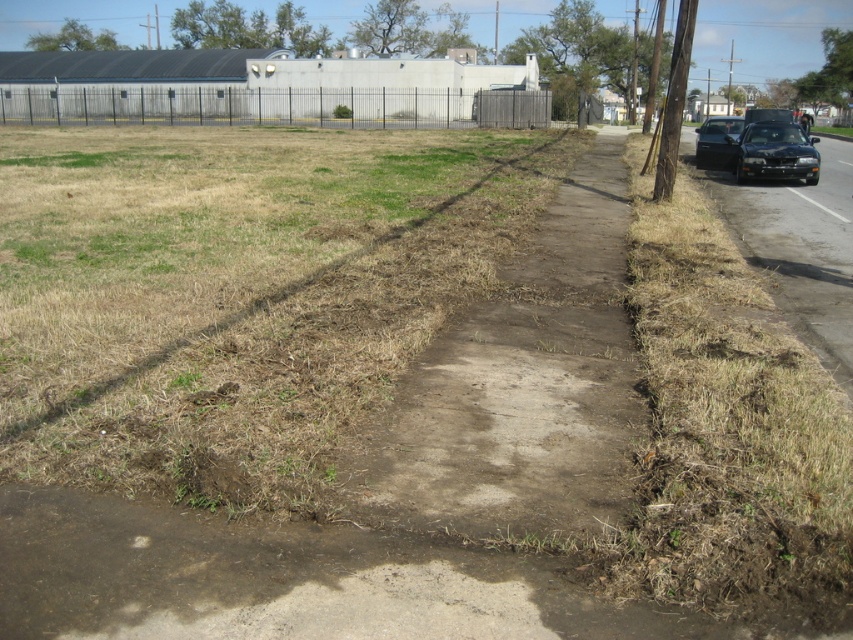
You are a delivery driver who needs to park your black glossy car at right in a spot that is as wide as the black metal fence at upper left. Is there enough space for the car to park there?

The black metal fence at upper left has a larger width than the black glossy car at right, so there is enough space for the car to park there.

You are a delivery driver who needs to park your truck between the shiny black sedan at right and the black glossy car at right. Your truck is 5 meters long. Is there enough space between them to park your truck?

The shiny black sedan at right and the black glossy car at right are 4.96 meters apart. Since your truck is 5 meters long, there is not enough space to park between them.

You are standing at the point marked as point (279, 106) in the image. What object is this point located on?

The point (279, 106) is located on the black metal fence at upper left.